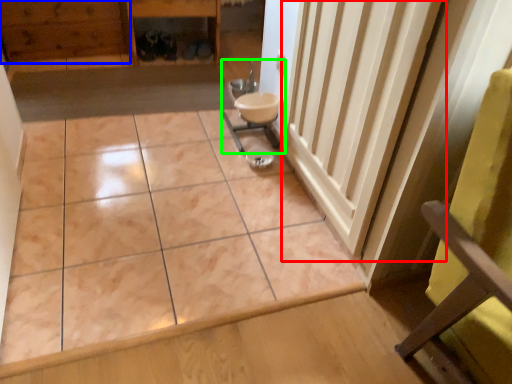
Question: Which object is the closest to the radiator (highlighted by a red box)? Choose among these: hardwood (highlighted by a blue box) or sink (highlighted by a green box).

Choices:
 (A) hardwood
 (B) sink

Answer: (B)